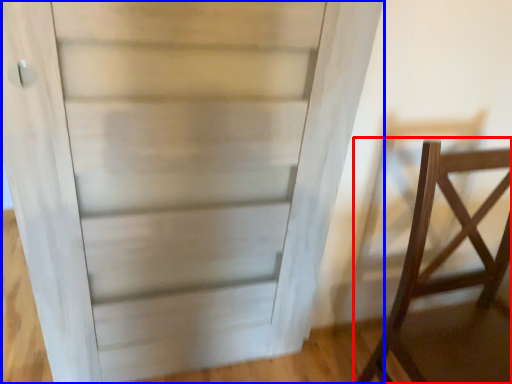
Question: Which object is further to the camera taking this photo, furniture (highlighted by a red box) or door (highlighted by a blue box)?

Choices:
 (A) furniture
 (B) door

Answer: (B)